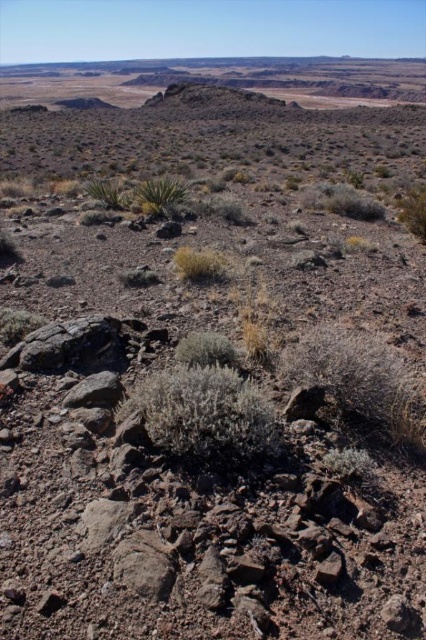
Can you confirm if green leafy plant at center is positioned to the right of green fuzzy bush at right?

No, green leafy plant at center is not to the right of green fuzzy bush at right.

Find the location of a particular element. green leafy plant at center is located at coordinates (160, 195).

Can you confirm if dry grass at center is bigger than green leafy plant at center-left?

Actually, dry grass at center might be smaller than green leafy plant at center-left.

Is point (184, 246) positioned before point (108, 204)?

Yes, it is in front of point (108, 204).

I want to click on dry grass at center, so click(199, 264).

Does green fuzzy bush at center have a lesser width compared to dry grass at center?

Yes, green fuzzy bush at center is thinner than dry grass at center.

From the picture: Which is above, green fuzzy bush at center or dry grass at center?

Positioned higher is dry grass at center.

Is point (224, 364) farther from viewer compared to point (181, 257)?

No, (224, 364) is closer to viewer.

Identify the location of green fuzzy bush at center. (206, 349).